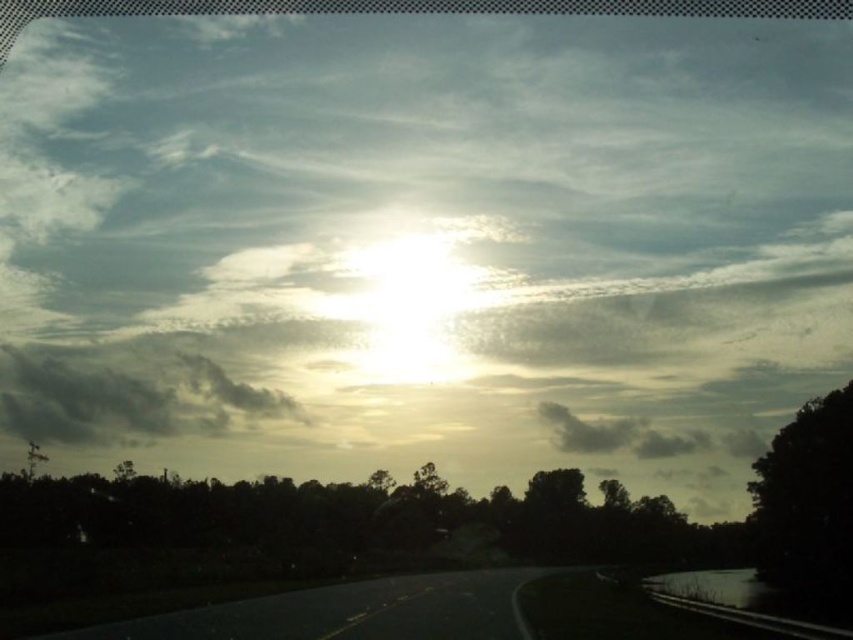
Between point (805, 433) and point (692, 440), which one is positioned in front?

Point (805, 433) is more forward.

Is dark green leafy tree at right to the left of dark gray fluffy cloud at upper center from the viewer's perspective?

Yes, dark green leafy tree at right is to the left of dark gray fluffy cloud at upper center.

Is point (828, 464) more distant than point (756, 452)?

No.

The image size is (853, 640). I want to click on dark green leafy tree at right, so click(807, 506).

Is silhouette leafy tree at lower center below dark green leafy tree at right?

Indeed, silhouette leafy tree at lower center is positioned under dark green leafy tree at right.

What do you see at coordinates (357, 516) in the screenshot? I see `silhouette leafy tree at lower center` at bounding box center [357, 516].

Which is behind, point (7, 477) or point (804, 477)?

The point (7, 477) is more distant.

Identify the location of silhouette leafy tree at lower center. Image resolution: width=853 pixels, height=640 pixels. (357, 516).

Who is more distant from viewer, [552,547] or [573,426]?

The point [573,426] is more distant.

Describe the element at coordinates (357, 516) in the screenshot. Image resolution: width=853 pixels, height=640 pixels. I see `silhouette leafy tree at lower center` at that location.

Between point (686, 524) and point (694, 449), which one is positioned behind?

Positioned behind is point (694, 449).

At what (x,y) coordinates should I click in order to perform the action: click on silhouette leafy tree at lower center. Please return your answer as a coordinate pair (x, y). Image resolution: width=853 pixels, height=640 pixels. Looking at the image, I should click on (357, 516).